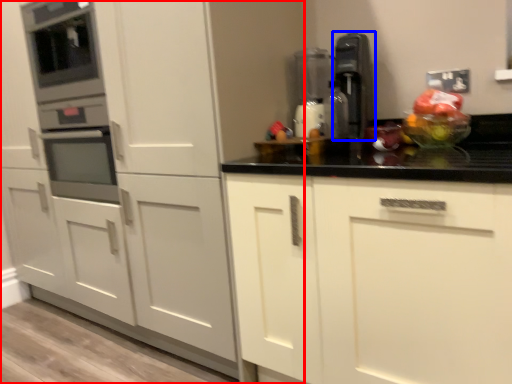
Question: Which of the following is the closest to the observer, cabinetry (highlighted by a red box) or kitchen appliance (highlighted by a blue box)?

Choices:
 (A) cabinetry
 (B) kitchen appliance

Answer: (A)